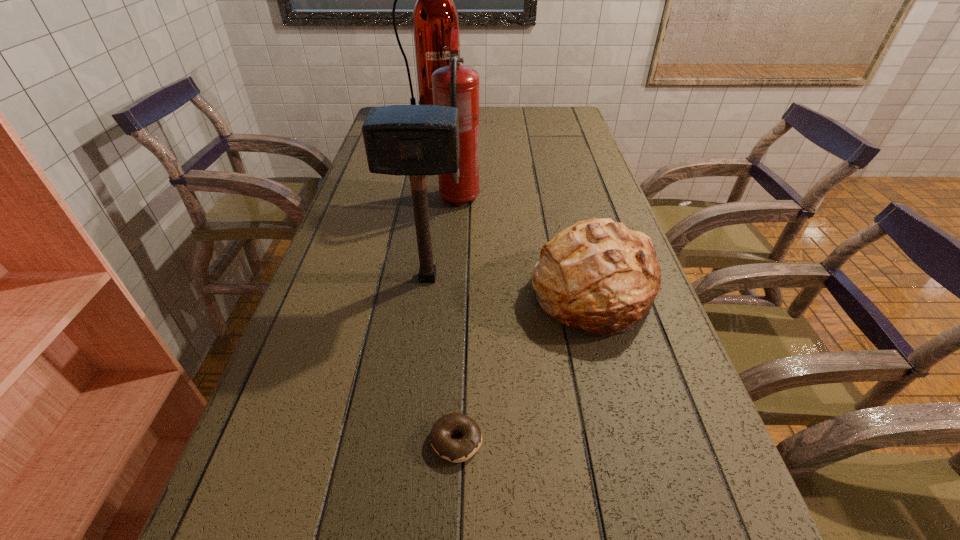
I want to click on vacant region located 0.220m on the handle side the fourth nearest object, so click(463, 151).

You are a GUI agent. You are given a task and a screenshot of the screen. Output one action in this format:
    pyautogui.click(x=<x>, y=<y>)
    Task: Click on the blank space located 0.190m on the handle side the fourth nearest object
    
    Given the screenshot: What is the action you would take?
    pyautogui.click(x=463, y=155)

You are a GUI agent. You are given a task and a screenshot of the screen. Output one action in this format:
    pyautogui.click(x=<x>, y=<y>)
    Task: Click on the free location located 0.210m on the handle side the fourth nearest object
    
    Given the screenshot: What is the action you would take?
    pyautogui.click(x=463, y=152)

Where is `vacant space situated 0.260m on the right of the mallet`? The width and height of the screenshot is (960, 540). vacant space situated 0.260m on the right of the mallet is located at coordinates (575, 278).

I want to click on vacant region located 0.270m on the back of the second shortest object, so click(565, 194).

Locate an element on the screen. This screenshot has width=960, height=540. vacant area situated 0.300m on the back of the doughnut is located at coordinates (463, 295).

Locate an element on the screen. object that is positioned at the far edge is located at coordinates (434, 15).

Where is `object present at the left edge`? The height and width of the screenshot is (540, 960). object present at the left edge is located at coordinates (434, 15).

Where is `object situated at the right edge`? object situated at the right edge is located at coordinates (598, 276).

This screenshot has width=960, height=540. I want to click on object at the far left corner, so click(x=434, y=15).